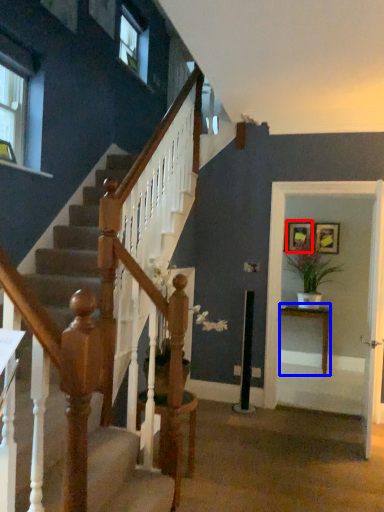
Question: Among these objects, which one is nearest to the camera, picture frame (highlighted by a red box) or table (highlighted by a blue box)?

Choices:
 (A) picture frame
 (B) table

Answer: (B)